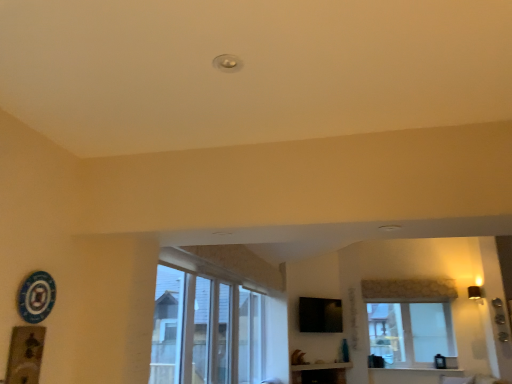
Question: Can you confirm if white textured wood at lower center is bigger than white glass window at center?

Choices:
 (A) no
 (B) yes

Answer: (A)

Question: Is white textured wood at lower center thinner than white glass window at center?

Choices:
 (A) yes
 (B) no

Answer: (A)

Question: Is white textured wood at lower center wider than white glass window at center?

Choices:
 (A) yes
 (B) no

Answer: (B)

Question: From the image's perspective, is white textured wood at lower center above white glass window at center?

Choices:
 (A) yes
 (B) no

Answer: (B)

Question: Considering the relative sizes of white textured wood at lower center and white glass window at center in the image provided, is white textured wood at lower center smaller than white glass window at center?

Choices:
 (A) yes
 (B) no

Answer: (A)

Question: From the image's perspective, is white textured wood at lower center located above or below black glossy tv at upper center?

Choices:
 (A) above
 (B) below

Answer: (B)

Question: Considering the positions of white textured wood at lower center and black glossy tv at upper center in the image, is white textured wood at lower center taller or shorter than black glossy tv at upper center?

Choices:
 (A) short
 (B) tall

Answer: (A)

Question: Looking at their shapes, would you say white textured wood at lower center is wider or thinner than black glossy tv at upper center?

Choices:
 (A) wide
 (B) thin

Answer: (A)

Question: Is point (457, 370) positioned closer to the camera than point (340, 314)?

Choices:
 (A) closer
 (B) farther

Answer: (A)

Question: In terms of width, does white textured wood at lower center look wider or thinner when compared to white glass window at center?

Choices:
 (A) wide
 (B) thin

Answer: (B)

Question: Is white textured wood at lower center situated inside white glass window at center or outside?

Choices:
 (A) outside
 (B) inside

Answer: (A)

Question: Does point (430, 370) appear closer or farther from the camera than point (375, 299)?

Choices:
 (A) farther
 (B) closer

Answer: (B)

Question: Would you say white textured wood at lower center is to the left or to the right of white glass window at center in the picture?

Choices:
 (A) left
 (B) right

Answer: (B)

Question: Considering the positions of point (410, 360) and point (320, 319), is point (410, 360) closer or farther from the camera than point (320, 319)?

Choices:
 (A) farther
 (B) closer

Answer: (B)

Question: In terms of height, does white glass window at center look taller or shorter compared to black glossy tv at upper center?

Choices:
 (A) short
 (B) tall

Answer: (B)